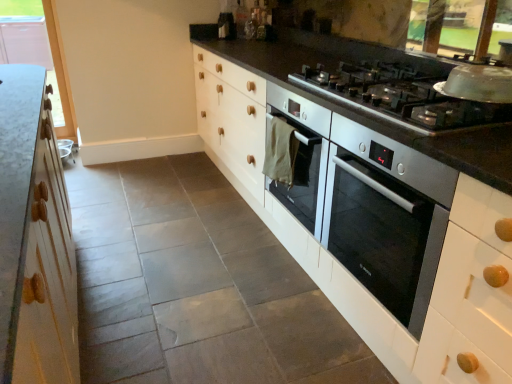
Question: Is satin silver gas stove at upper right positioned with its back to satin silver oven at center-right?

Choices:
 (A) yes
 (B) no

Answer: (B)

Question: Can you confirm if satin silver gas stove at upper right is positioned to the right of satin silver oven at center-right?

Choices:
 (A) yes
 (B) no

Answer: (B)

Question: From a real-world perspective, does satin silver gas stove at upper right sit lower than satin silver oven at center-right?

Choices:
 (A) yes
 (B) no

Answer: (B)

Question: Can you confirm if satin silver gas stove at upper right is taller than satin silver oven at center-right?

Choices:
 (A) yes
 (B) no

Answer: (B)

Question: Can you confirm if satin silver gas stove at upper right is wider than satin silver oven at center-right?

Choices:
 (A) yes
 (B) no

Answer: (B)

Question: Is satin silver gas stove at upper right thinner than satin silver oven at center-right?

Choices:
 (A) no
 (B) yes

Answer: (B)

Question: Could you tell me if satin silver oven at center-right is turned towards satin silver gas stove at upper right?

Choices:
 (A) yes
 (B) no

Answer: (B)

Question: From a real-world perspective, does satin silver oven at center-right stand above satin silver gas stove at upper right?

Choices:
 (A) no
 (B) yes

Answer: (A)

Question: Can you confirm if satin silver oven at center-right is smaller than satin silver gas stove at upper right?

Choices:
 (A) yes
 (B) no

Answer: (B)

Question: Is satin silver oven at center-right closer to the viewer compared to satin silver gas stove at upper right?

Choices:
 (A) yes
 (B) no

Answer: (A)

Question: Is the depth of satin silver oven at center-right greater than that of satin silver gas stove at upper right?

Choices:
 (A) yes
 (B) no

Answer: (B)

Question: Would you say satin silver oven at center-right is a long distance from satin silver gas stove at upper right?

Choices:
 (A) yes
 (B) no

Answer: (B)

Question: Considering the relative sizes of clear glass window at upper left and satin silver gas stove at upper right in the image provided, is clear glass window at upper left bigger than satin silver gas stove at upper right?

Choices:
 (A) yes
 (B) no

Answer: (A)